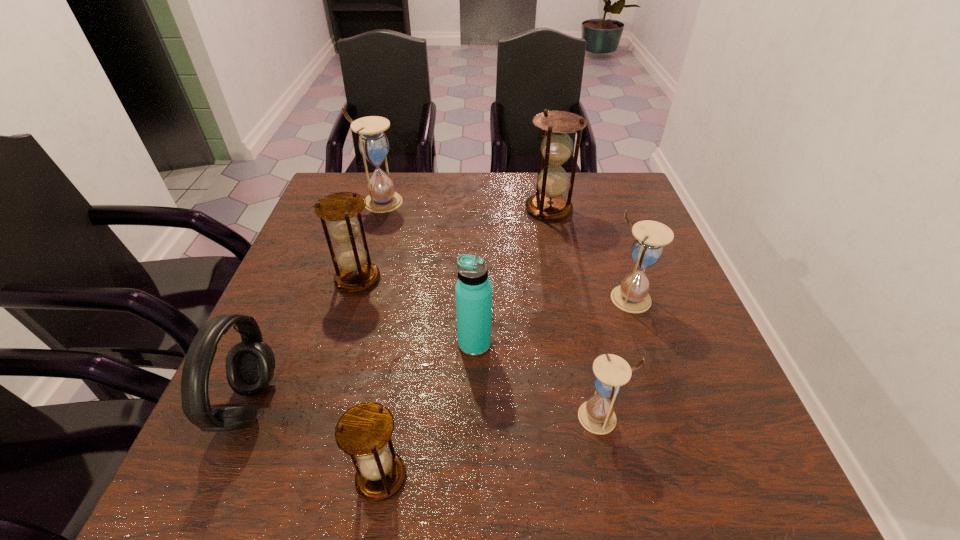
You are a GUI agent. You are given a task and a screenshot of the screen. Output one action in this format:
    pyautogui.click(x=<x>, y=<y>)
    Task: Click on the white hourglass identified as the second closest to the second smallest brown hourglass
    
    Given the screenshot: What is the action you would take?
    pyautogui.click(x=597, y=415)

At what (x,y) coordinates should I click in order to perform the action: click on brown hourglass object that ranks as the second closest to the second biggest brown hourglass. Please return your answer as a coordinate pair (x, y). The width and height of the screenshot is (960, 540). Looking at the image, I should click on (556, 147).

Image resolution: width=960 pixels, height=540 pixels. I want to click on brown hourglass identified as the second closest to the fifth farthest object, so click(x=357, y=273).

Locate an element on the screen. blank space that satisfies the following two spatial constraints: 1. on the front side of the fourth nearest object; 2. on the right side of the second farthest brown hourglass is located at coordinates (339, 344).

The width and height of the screenshot is (960, 540). I want to click on vacant space that satisfies the following two spatial constraints: 1. on the front side of the second nearest brown hourglass; 2. on the earcups of the gray headset, so click(x=321, y=404).

The height and width of the screenshot is (540, 960). Identify the location of free space in the image that satisfies the following two spatial constraints: 1. on the front side of the rightmost object; 2. on the left side of the leftmost brown hourglass. (352, 299).

Find the location of a particular element. This screenshot has height=540, width=960. free space that satisfies the following two spatial constraints: 1. on the earcups of the gray headset; 2. on the back side of the second white hourglass from right to left is located at coordinates (245, 417).

You are a GUI agent. You are given a task and a screenshot of the screen. Output one action in this format:
    pyautogui.click(x=<x>, y=<y>)
    Task: Click on the free space that satisfies the following two spatial constraints: 1. on the front side of the second biggest brown hourglass; 2. on the earcups of the gray headset
    
    Given the screenshot: What is the action you would take?
    pyautogui.click(x=321, y=404)

The width and height of the screenshot is (960, 540). In order to click on vacant space that satisfies the following two spatial constraints: 1. on the earcups of the leftmost object; 2. on the right side of the fifth farthest hourglass in this screenshot , I will do `click(245, 417)`.

In order to click on vacant space that satisfies the following two spatial constraints: 1. on the earcups of the third hourglass from left to right; 2. on the left side of the gray headset in this screenshot , I will do `click(219, 477)`.